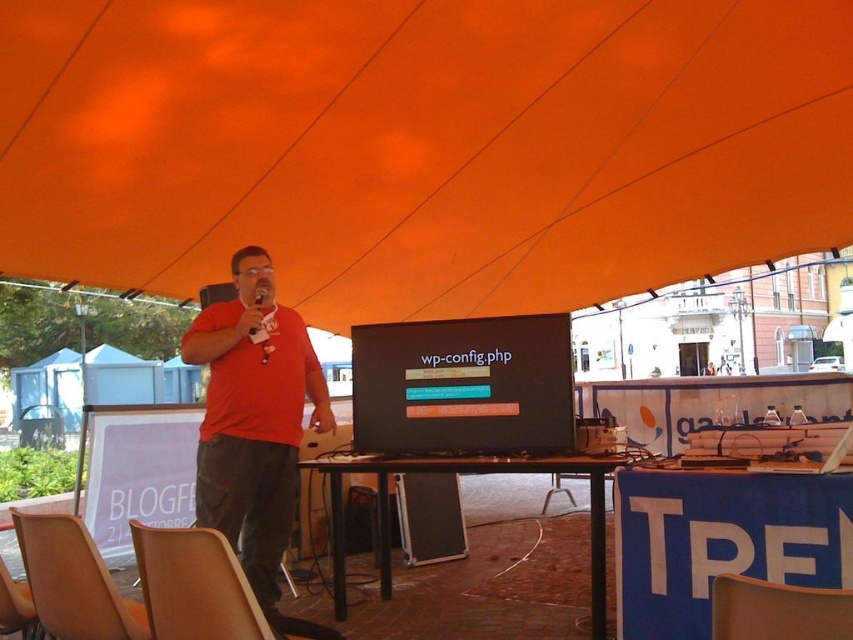
From the picture: Measure the distance between point (218, 634) and camera.

Point (218, 634) and camera are 5.85 feet apart from each other.

Who is positioned more to the left, brown leather chair at lower left or leather at center?

Positioned to the left is leather at center.

Image resolution: width=853 pixels, height=640 pixels. In order to click on brown leather chair at lower left in this screenshot , I will do `click(194, 586)`.

Where is `brown leather chair at lower left`? brown leather chair at lower left is located at coordinates (194, 586).

Who is more forward, (x=341, y=611) or (x=740, y=636)?

Point (x=740, y=636) is in front.

Does black wooden table at center have a lesser height compared to matte orange chair at lower right?

No, black wooden table at center is not shorter than matte orange chair at lower right.

Locate an element on the screen. This screenshot has width=853, height=640. black wooden table at center is located at coordinates (462, 472).

At what (x,y) coordinates should I click in order to perform the action: click on black wooden table at center. Please return your answer as a coordinate pair (x, y). This screenshot has width=853, height=640. Looking at the image, I should click on (462, 472).

Is matte red shirt at center taller than matte black speaker at lower center?

Yes.

From the picture: Is matte red shirt at center positioned in front of matte black speaker at lower center?

Yes.

Does point (231, 310) come in front of point (439, 532)?

Yes, point (231, 310) is in front of point (439, 532).

This screenshot has width=853, height=640. In order to click on matte red shirt at center in this screenshot , I will do 253,420.